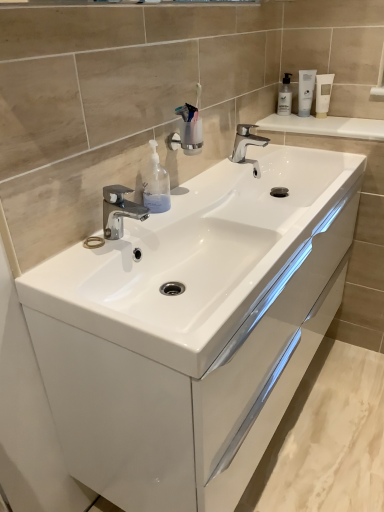
Question: Can you confirm if polished chrome tap at center, the 2th tap positioned from the back, is shorter than white glossy cabinet at center?

Choices:
 (A) no
 (B) yes

Answer: (B)

Question: Considering the relative positions of polished chrome tap at center, placed as the first tap when sorted from front to back, and white glossy cabinet at center in the image provided, is polished chrome tap at center, placed as the first tap when sorted from front to back, to the left of white glossy cabinet at center from the viewer's perspective?

Choices:
 (A) no
 (B) yes

Answer: (B)

Question: Considering the relative sizes of polished chrome tap at center, arranged as the first tap when viewed from the left, and white glossy cabinet at center in the image provided, is polished chrome tap at center, arranged as the first tap when viewed from the left, thinner than white glossy cabinet at center?

Choices:
 (A) yes
 (B) no

Answer: (A)

Question: Is polished chrome tap at center, placed as the first tap when sorted from front to back, located outside white glossy cabinet at center?

Choices:
 (A) yes
 (B) no

Answer: (A)

Question: Could you tell me if polished chrome tap at center, the second tap when ordered from top to bottom, is facing white glossy cabinet at center?

Choices:
 (A) no
 (B) yes

Answer: (A)

Question: Is white glossy cabinet at center bigger or smaller than white glossy tube at upper right?

Choices:
 (A) small
 (B) big

Answer: (B)

Question: Is white glossy cabinet at center situated inside white glossy tube at upper right or outside?

Choices:
 (A) inside
 (B) outside

Answer: (B)

Question: Looking at their shapes, would you say white glossy cabinet at center is wider or thinner than white glossy tube at upper right?

Choices:
 (A) thin
 (B) wide

Answer: (B)

Question: Considering the positions of point (279, 309) and point (326, 87), is point (279, 309) closer or farther from the camera than point (326, 87)?

Choices:
 (A) closer
 (B) farther

Answer: (A)

Question: From their relative heights in the image, would you say transparent plastic soap dispenser at center, the 1th soap dispenser from the bottom, is taller or shorter than white glossy cabinet at center?

Choices:
 (A) short
 (B) tall

Answer: (A)

Question: Relative to white glossy cabinet at center, is transparent plastic soap dispenser at center, which is counted as the 2th soap dispenser, starting from the top, in front or behind?

Choices:
 (A) behind
 (B) front

Answer: (A)

Question: Considering the relative positions of transparent plastic soap dispenser at center, which is counted as the 2th soap dispenser, starting from the back, and white glossy cabinet at center in the image provided, is transparent plastic soap dispenser at center, which is counted as the 2th soap dispenser, starting from the back, to the left or to the right of white glossy cabinet at center?

Choices:
 (A) left
 (B) right

Answer: (A)

Question: Is transparent plastic soap dispenser at center, the first soap dispenser positioned from the front, spatially inside white glossy cabinet at center, or outside of it?

Choices:
 (A) inside
 (B) outside

Answer: (B)

Question: Is translucent plastic soap dispenser at upper right, which ranks as the first soap dispenser in back-to-front order, inside or outside of polished chrome tap at center, the second tap when ordered from top to bottom?

Choices:
 (A) inside
 (B) outside

Answer: (B)

Question: Is point (284, 91) closer or farther from the camera than point (134, 212)?

Choices:
 (A) closer
 (B) farther

Answer: (B)